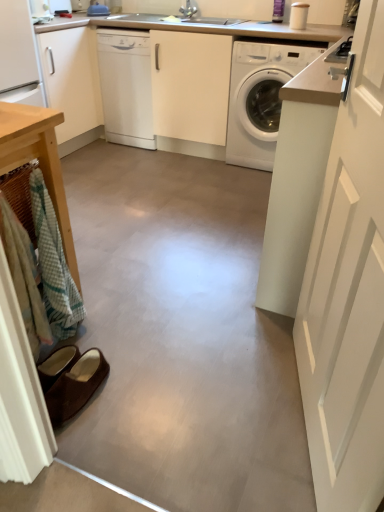
Question: Does white glossy counter top at upper center have a larger size compared to wooden table at left?

Choices:
 (A) yes
 (B) no

Answer: (A)

Question: Is white glossy counter top at upper center behind wooden table at left?

Choices:
 (A) no
 (B) yes

Answer: (B)

Question: From a real-world perspective, is white glossy counter top at upper center positioned over wooden table at left based on gravity?

Choices:
 (A) no
 (B) yes

Answer: (B)

Question: Is white glossy counter top at upper center facing away from wooden table at left?

Choices:
 (A) yes
 (B) no

Answer: (B)

Question: From a real-world perspective, is white glossy counter top at upper center positioned under wooden table at left based on gravity?

Choices:
 (A) no
 (B) yes

Answer: (A)

Question: Considering the relative sizes of white glossy counter top at upper center and wooden table at left in the image provided, is white glossy counter top at upper center taller than wooden table at left?

Choices:
 (A) no
 (B) yes

Answer: (B)

Question: Does white glossy washing machine at center have a lesser width compared to brown suede slippers at lower left?

Choices:
 (A) no
 (B) yes

Answer: (A)

Question: Is white glossy washing machine at center taller than brown suede slippers at lower left?

Choices:
 (A) yes
 (B) no

Answer: (A)

Question: Is white glossy washing machine at center looking in the opposite direction of brown suede slippers at lower left?

Choices:
 (A) no
 (B) yes

Answer: (A)

Question: From a real-world perspective, is white glossy washing machine at center beneath brown suede slippers at lower left?

Choices:
 (A) yes
 (B) no

Answer: (B)

Question: Is white glossy washing machine at center shorter than brown suede slippers at lower left?

Choices:
 (A) no
 (B) yes

Answer: (A)

Question: Could you tell me if white glossy washing machine at center is facing brown suede slippers at lower left?

Choices:
 (A) no
 (B) yes

Answer: (B)

Question: Is white matte cabinet at upper left bigger than brown suede slippers at lower left?

Choices:
 (A) no
 (B) yes

Answer: (B)